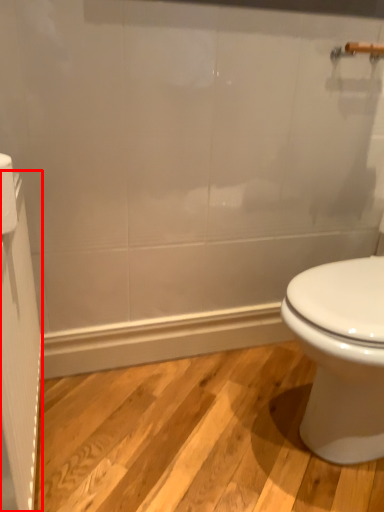
Question: From the image's perspective, considering the relative positions of screen door (annotated by the red box) and toilet paper in the image provided, where is screen door (annotated by the red box) located with respect to the staircase?

Choices:
 (A) above
 (B) below

Answer: (B)